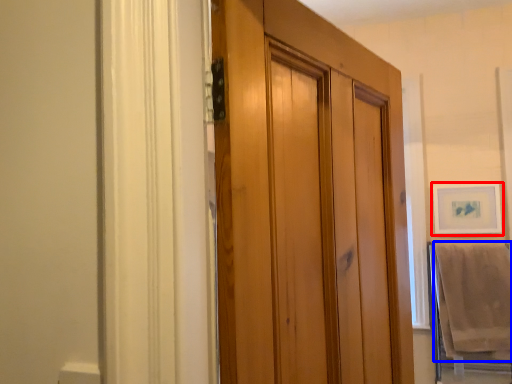
Question: Among these objects, which one is nearest to the camera, picture frame (highlighted by a red box) or bath towel (highlighted by a blue box)?

Choices:
 (A) picture frame
 (B) bath towel

Answer: (B)